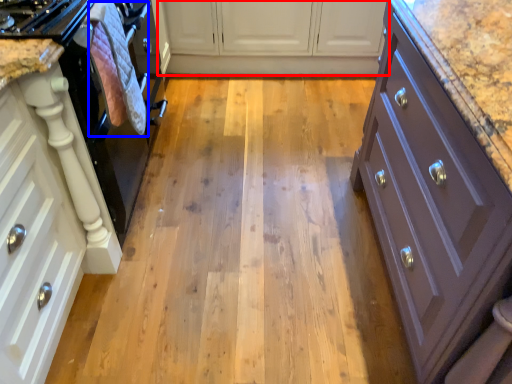
Question: Which object is closer to the camera taking this photo, cabinetry (highlighted by a red box) or material (highlighted by a blue box)?

Choices:
 (A) cabinetry
 (B) material

Answer: (B)